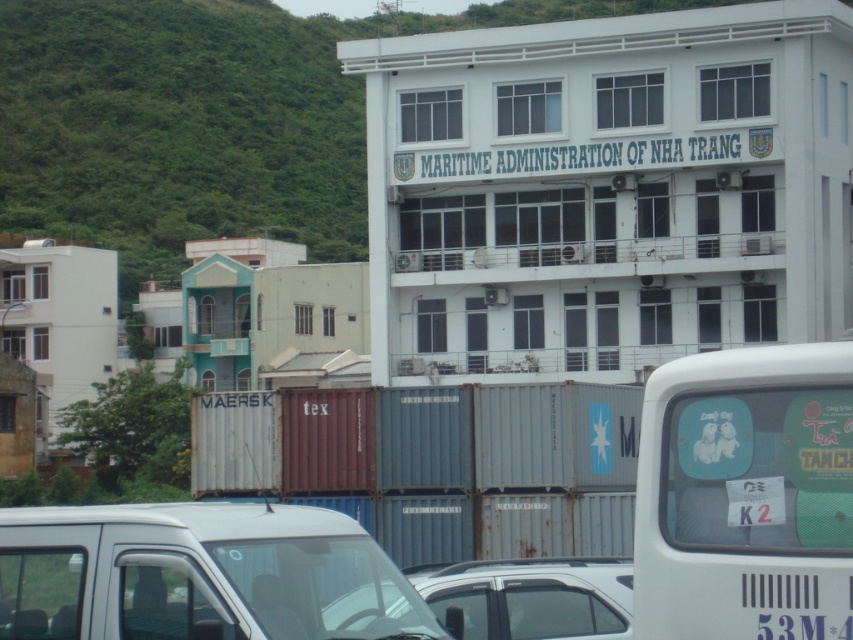
Question: Among these points, which one is farthest from the camera?

Choices:
 (A) (202, 556)
 (B) (703, 524)

Answer: (A)

Question: Among these points, which one is farthest from the camera?

Choices:
 (A) (717, 461)
 (B) (345, 544)
 (C) (502, 580)

Answer: (C)

Question: Does white matte van at right have a larger size compared to white matte van at lower left?

Choices:
 (A) no
 (B) yes

Answer: (B)

Question: Is white matte van at right in front of white matte van at lower left?

Choices:
 (A) yes
 (B) no

Answer: (A)

Question: Estimate the real-world distances between objects in this image. Which object is farther from the white matte van at lower left?

Choices:
 (A) white matte car at center
 (B) white matte van at right

Answer: (B)

Question: Does white matte van at right appear on the right side of white matte car at center?

Choices:
 (A) no
 (B) yes

Answer: (B)